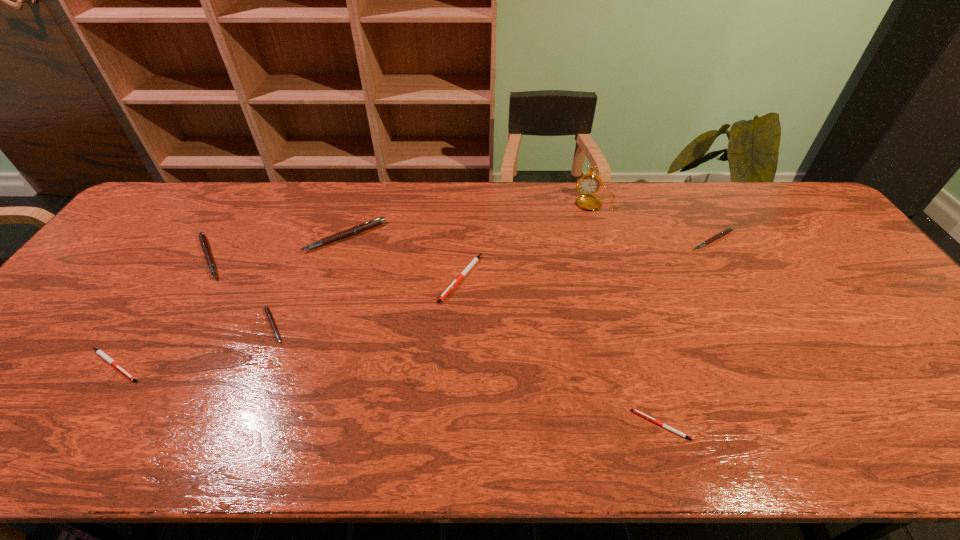
This screenshot has width=960, height=540. Identify the location of the tallest object. (587, 184).

The height and width of the screenshot is (540, 960). I want to click on pocket watch, so click(587, 184).

Locate an element on the screen. the biggest pink pen is located at coordinates (367, 225).

The image size is (960, 540). In order to click on the seventh shortest object in this screenshot , I will do `click(367, 225)`.

At what (x,y) coordinates should I click in order to perform the action: click on the leftmost pink pen. Please return your answer as a coordinate pair (x, y). This screenshot has width=960, height=540. Looking at the image, I should click on (203, 241).

You are a GUI agent. You are given a task and a screenshot of the screen. Output one action in this format:
    pyautogui.click(x=<x>, y=<y>)
    Task: Click on the third tallest object
    Image resolution: width=960 pixels, height=540 pixels.
    Given the screenshot: What is the action you would take?
    pyautogui.click(x=203, y=241)

Locate an element on the screen. The width and height of the screenshot is (960, 540). the second smallest pink pen is located at coordinates (728, 230).

Where is `the rightmost pen`? The width and height of the screenshot is (960, 540). the rightmost pen is located at coordinates (728, 230).

The image size is (960, 540). In order to click on the fifth object from left to right in this screenshot , I will do `click(473, 262)`.

Image resolution: width=960 pixels, height=540 pixels. Find the location of `the biggest white pen`. the biggest white pen is located at coordinates [x=473, y=262].